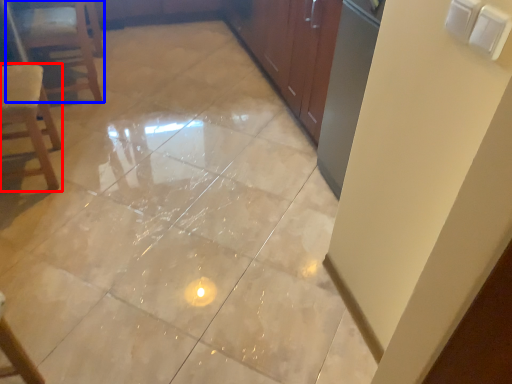
Question: Which point is closer to the camera, chair (highlighted by a red box) or furniture (highlighted by a blue box)?

Choices:
 (A) chair
 (B) furniture

Answer: (A)